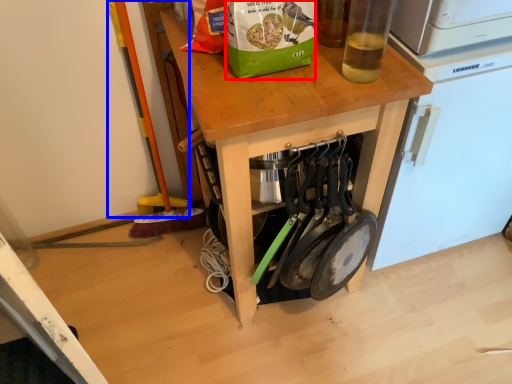
Question: Which point is closer to the camera, paper bag (highlighted by a red box) or brush (highlighted by a blue box)?

Choices:
 (A) paper bag
 (B) brush

Answer: (A)